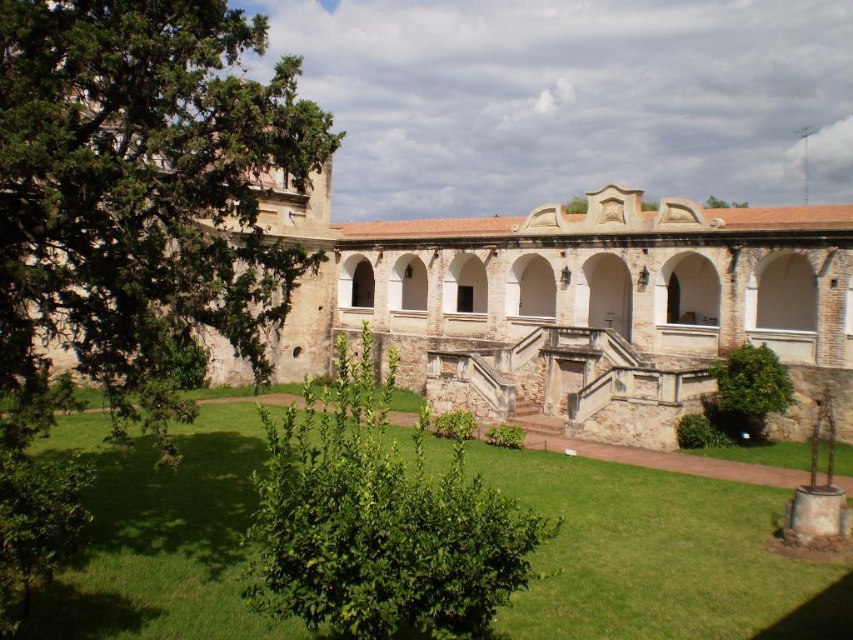
Does green leafy bush at center have a larger size compared to green leafy tree at lower right?

Yes.

Between point (349, 531) and point (712, 368), which one is positioned in front?

Point (349, 531) is in front.

In order to click on green leafy bush at center in this screenshot , I will do `click(379, 522)`.

Is point (486, 314) farther from camera compared to point (53, 240)?

Yes, point (486, 314) is farther from viewer.

Does brown stone building at center appear on the right side of green leafy tree at left?

Correct, you'll find brown stone building at center to the right of green leafy tree at left.

Is point (283, 333) farther from camera compared to point (102, 86)?

Yes, point (283, 333) is farther from viewer.

Where is `brown stone building at center`? The width and height of the screenshot is (853, 640). brown stone building at center is located at coordinates (468, 301).

Can you confirm if green leafy tree at left is positioned to the left of green leafy tree at lower right?

Correct, you'll find green leafy tree at left to the left of green leafy tree at lower right.

Which is behind, point (171, 333) or point (761, 362)?

The point (761, 362) is more distant.

Is point (16, 436) behind point (747, 396)?

No, (16, 436) is closer to viewer.

The width and height of the screenshot is (853, 640). I want to click on green leafy tree at left, so click(x=138, y=198).